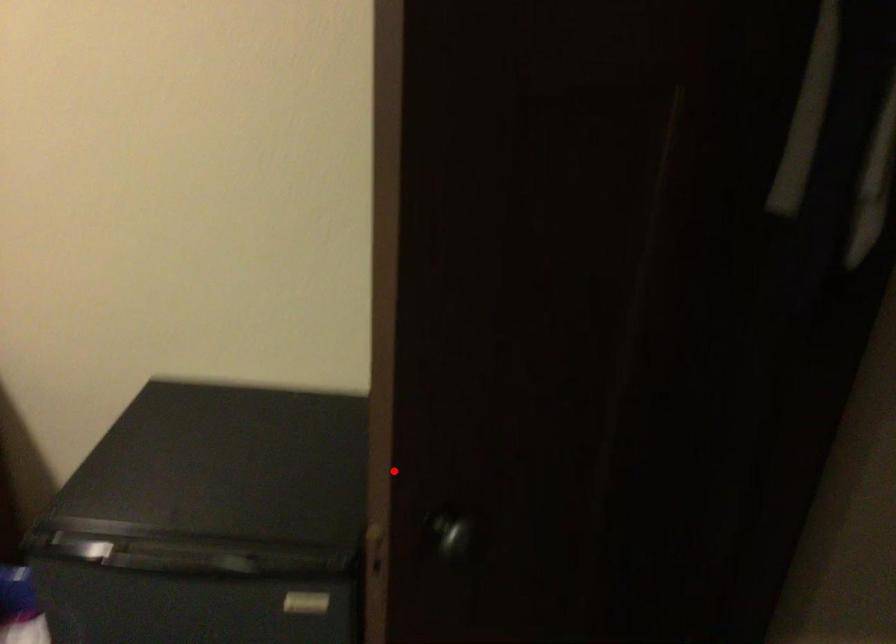
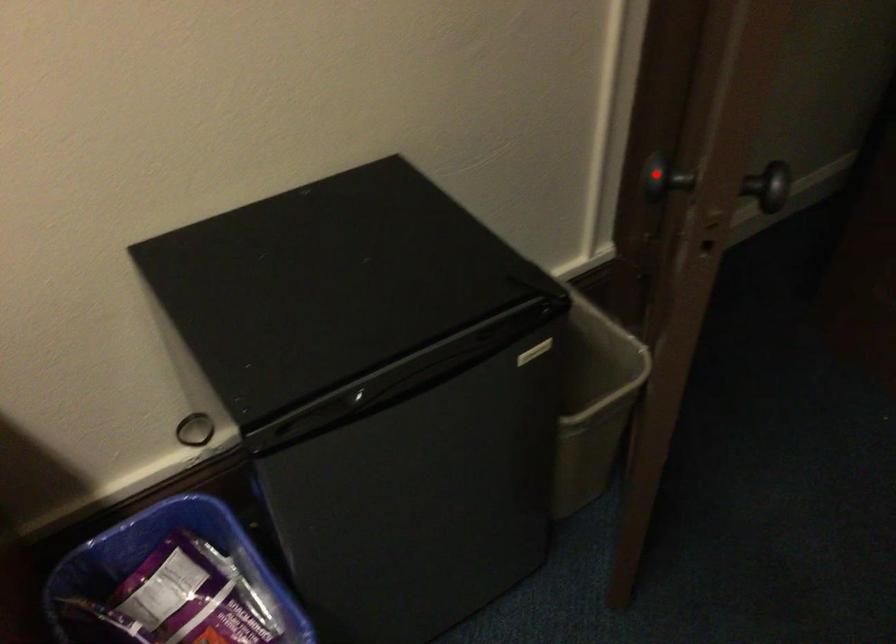
I am providing you with two images of the same scene from different viewpoints. A red point is marked on the first image and another point is marked on the second image. Is the red point in image1 aligned with the point shown in image2?

Yes